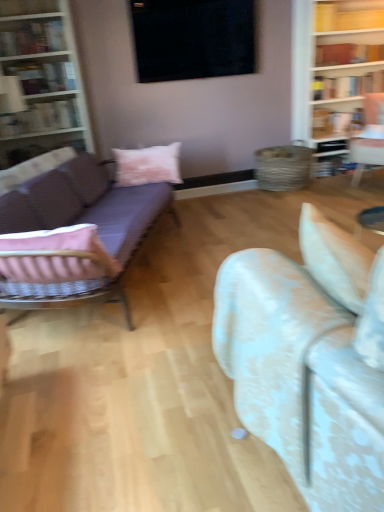
Question: Does black matte window at upper center have a smaller size compared to pink cotton pillow at center?

Choices:
 (A) no
 (B) yes

Answer: (A)

Question: Is black matte window at upper center not inside pink cotton pillow at center?

Choices:
 (A) no
 (B) yes

Answer: (B)

Question: From the image's perspective, is black matte window at upper center on pink cotton pillow at center?

Choices:
 (A) yes
 (B) no

Answer: (A)

Question: Does black matte window at upper center have a greater height compared to pink cotton pillow at center?

Choices:
 (A) no
 (B) yes

Answer: (B)

Question: Is the surface of black matte window at upper center in direct contact with pink cotton pillow at center?

Choices:
 (A) no
 (B) yes

Answer: (A)

Question: Is black matte window at upper center looking in the opposite direction of pink cotton pillow at center?

Choices:
 (A) no
 (B) yes

Answer: (A)

Question: From a real-world perspective, is yellow wood shelf at upper right physically above velvet beige armchair at right?

Choices:
 (A) yes
 (B) no

Answer: (A)

Question: Is yellow wood shelf at upper right to the right of velvet beige armchair at right from the viewer's perspective?

Choices:
 (A) no
 (B) yes

Answer: (A)

Question: From the image's perspective, is yellow wood shelf at upper right beneath velvet beige armchair at right?

Choices:
 (A) yes
 (B) no

Answer: (B)

Question: Is yellow wood shelf at upper right aimed at velvet beige armchair at right?

Choices:
 (A) no
 (B) yes

Answer: (A)

Question: Would you say yellow wood shelf at upper right is outside velvet beige armchair at right?

Choices:
 (A) yes
 (B) no

Answer: (A)

Question: From a real-world perspective, is yellow wood shelf at upper right under velvet beige armchair at right?

Choices:
 (A) yes
 (B) no

Answer: (B)

Question: From the image's perspective, would you say purple fabric couch at left, which is counted as the first studio couch, starting from the back, is shown under white floral fabric couch at center, the 2th studio couch positioned from the back?

Choices:
 (A) no
 (B) yes

Answer: (A)